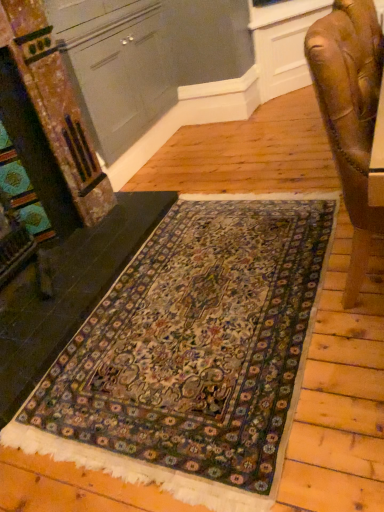
Question: Is carpet at lower left bigger than carpeted rug at center?

Choices:
 (A) yes
 (B) no

Answer: (A)

Question: Is carpet at lower left oriented away from carpeted rug at center?

Choices:
 (A) yes
 (B) no

Answer: (B)

Question: Can you confirm if carpet at lower left is thinner than carpeted rug at center?

Choices:
 (A) no
 (B) yes

Answer: (B)

Question: From a real-world perspective, is carpet at lower left positioned under carpeted rug at center based on gravity?

Choices:
 (A) yes
 (B) no

Answer: (B)

Question: Can you confirm if carpet at lower left is shorter than carpeted rug at center?

Choices:
 (A) yes
 (B) no

Answer: (B)

Question: From their relative heights in the image, would you say matte gray cabinet at upper left is taller or shorter than carpeted rug at center?

Choices:
 (A) tall
 (B) short

Answer: (A)

Question: In the image, is matte gray cabinet at upper left on the left side or the right side of carpeted rug at center?

Choices:
 (A) left
 (B) right

Answer: (A)

Question: From a real-world perspective, relative to carpeted rug at center, is matte gray cabinet at upper left vertically above or below?

Choices:
 (A) below
 (B) above

Answer: (B)

Question: Relative to carpeted rug at center, is matte gray cabinet at upper left in front or behind?

Choices:
 (A) front
 (B) behind

Answer: (B)

Question: From the image's perspective, relative to matte gray cabinet at upper left, is carpeted rug at center above or below?

Choices:
 (A) below
 (B) above

Answer: (A)

Question: Is carpeted rug at center taller or shorter than matte gray cabinet at upper left?

Choices:
 (A) tall
 (B) short

Answer: (B)

Question: Based on their sizes in the image, would you say carpeted rug at center is bigger or smaller than matte gray cabinet at upper left?

Choices:
 (A) small
 (B) big

Answer: (A)

Question: Does point (183, 234) appear closer or farther from the camera than point (122, 73)?

Choices:
 (A) farther
 (B) closer

Answer: (B)

Question: Do you think wooden carved chair at right is within carpeted rug at center, or outside of it?

Choices:
 (A) outside
 (B) inside

Answer: (A)

Question: Is wooden carved chair at right wider or thinner than carpeted rug at center?

Choices:
 (A) thin
 (B) wide

Answer: (A)